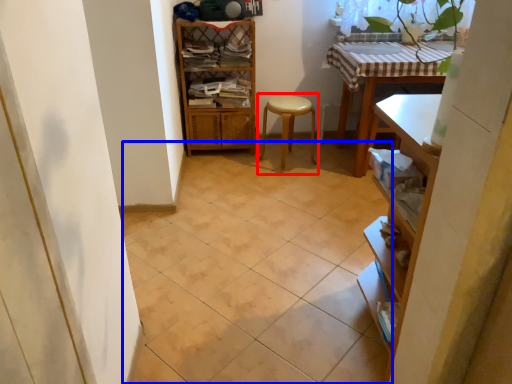
Question: Which object is closer to the camera taking this photo, step stool (highlighted by a red box) or ceramic tile (highlighted by a blue box)?

Choices:
 (A) step stool
 (B) ceramic tile

Answer: (B)